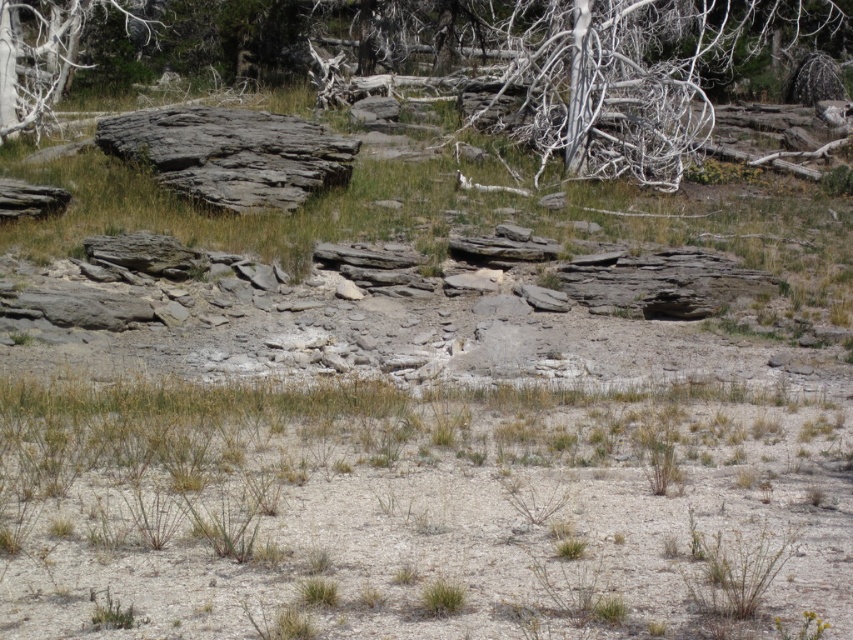
You are standing at the origin point of the image. Where is the dry grass at lower center located in terms of coordinates?

The dry grass at lower center is located at coordinates point (x=415, y=513).

You are standing at the origin point in the image. Where is the dry grass at lower center located in terms of coordinates?

The dry grass at lower center is located at coordinates point (415, 513).

You are standing in the middle of the arid landscape and want to reach both point (610,412) and point (618,148). Which point should you head towards first if you want to reach the one closer to you?

You should head towards point (610,412) first because it is closer to you than point (618,148).